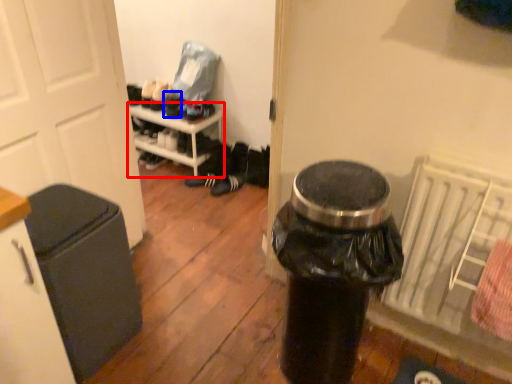
Question: Among these objects, which one is nearest to the camera, furniture (highlighted by a red box) or shoe (highlighted by a blue box)?

Choices:
 (A) furniture
 (B) shoe

Answer: (A)